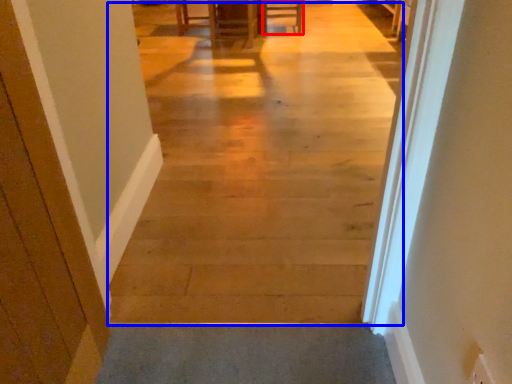
Question: Which object is further to the camera taking this photo, furniture (highlighted by a red box) or aisle (highlighted by a blue box)?

Choices:
 (A) furniture
 (B) aisle

Answer: (A)